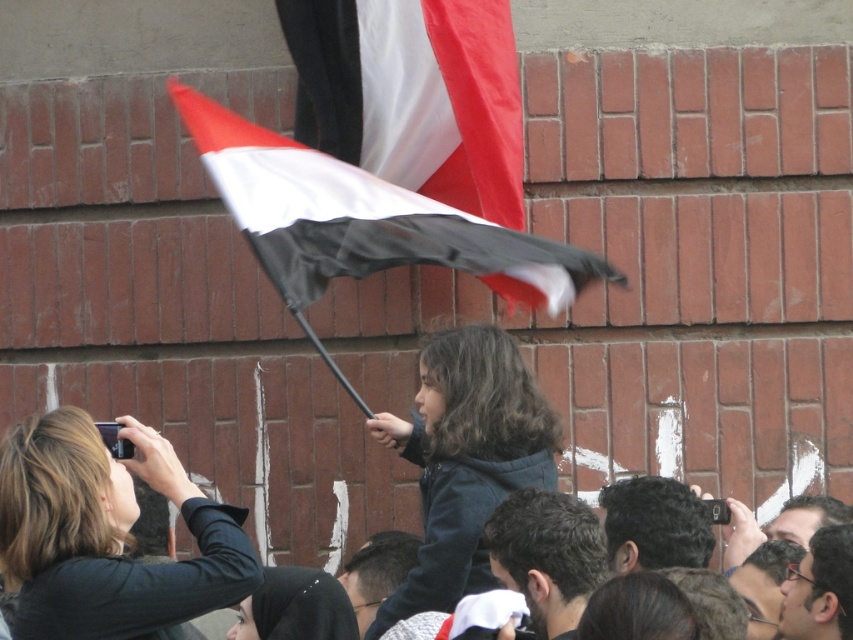
Between point (489, 284) and point (409, 538), which one is positioned behind?

The point (409, 538) is more distant.

Between point (347, 83) and point (343, 572), which one is positioned behind?

The point (343, 572) is behind.

In order to click on red-white-black fabric flag at upper center in this screenshot , I will do `click(413, 96)`.

Is dark brown hair at center in front of dark brown hair at lower center?

Yes.

Which is behind, point (567, 563) or point (395, 550)?

Point (395, 550)

Find the location of a particular element. The image size is (853, 640). dark brown hair at center is located at coordinates (547, 556).

Which is more to the right, red-white-black fabric flag at upper center or matte black glasses at center?

matte black glasses at center

Is the position of red-white-black fabric flag at upper center less distant than that of matte black glasses at center?

No, it is behind matte black glasses at center.

Between point (444, 164) and point (838, 541), which one is positioned behind?

Point (444, 164)

Where is `red-white-black fabric flag at upper center`? red-white-black fabric flag at upper center is located at coordinates (413, 96).